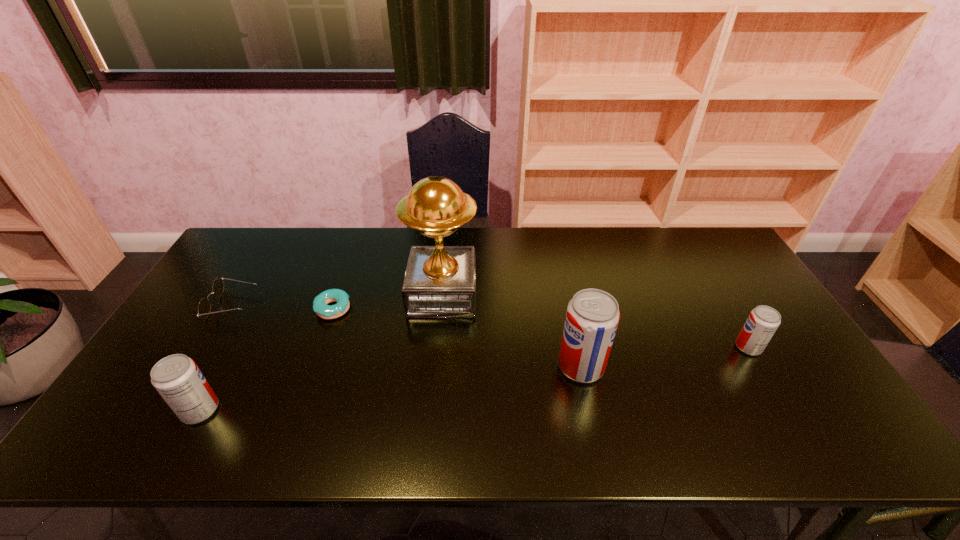
What are the coordinates of `empty location between the second shortest object and the third object from left to right` in the screenshot? It's located at (283, 307).

You are a GUI agent. You are given a task and a screenshot of the screen. Output one action in this format:
    pyautogui.click(x=<x>, y=<y>)
    Task: Click on the free space between the shortest soda and the fourth shortest object
    This screenshot has height=540, width=960.
    Given the screenshot: What is the action you would take?
    pyautogui.click(x=474, y=379)

Image resolution: width=960 pixels, height=540 pixels. Find the location of `vacant region between the tallest object and the second shortest soda`. vacant region between the tallest object and the second shortest soda is located at coordinates (322, 352).

This screenshot has height=540, width=960. What are the coordinates of `vacant space that's between the spectacles and the shortest soda` in the screenshot? It's located at (491, 326).

Where is `free point between the second soda from right to left and the shortest object`? free point between the second soda from right to left and the shortest object is located at coordinates (457, 338).

The height and width of the screenshot is (540, 960). Identify the location of object that stands as the second closest to the leftmost soda. (320, 302).

Identify which object is the third closest to the fourth shortest object. Please provide its 2D coordinates. Your answer should be formatted as a tuple, i.e. [(x, y)], where the tuple contains the x and y coordinates of a point satisfying the conditions above.

[(440, 281)]

Where is `soda that stands as the closest to the third shortest object`? This screenshot has width=960, height=540. soda that stands as the closest to the third shortest object is located at coordinates (592, 317).

Find the location of a particular element. This screenshot has height=540, width=960. soda that is the closest to the fourth shortest object is located at coordinates (592, 317).

Find the location of a particular element. Image resolution: width=960 pixels, height=540 pixels. vacant region that satisfies the following two spatial constraints: 1. on the back side of the nearest object; 2. on the front-facing side of the spectacles is located at coordinates (257, 305).